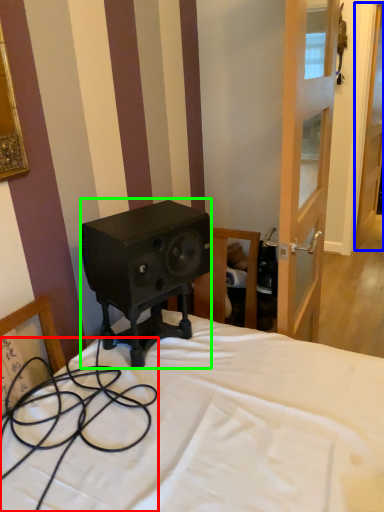
Question: Which object is positioned farthest from cable (highlighted by a red box)? Select from door (highlighted by a blue box) and loudspeaker (highlighted by a green box).

Choices:
 (A) door
 (B) loudspeaker

Answer: (A)